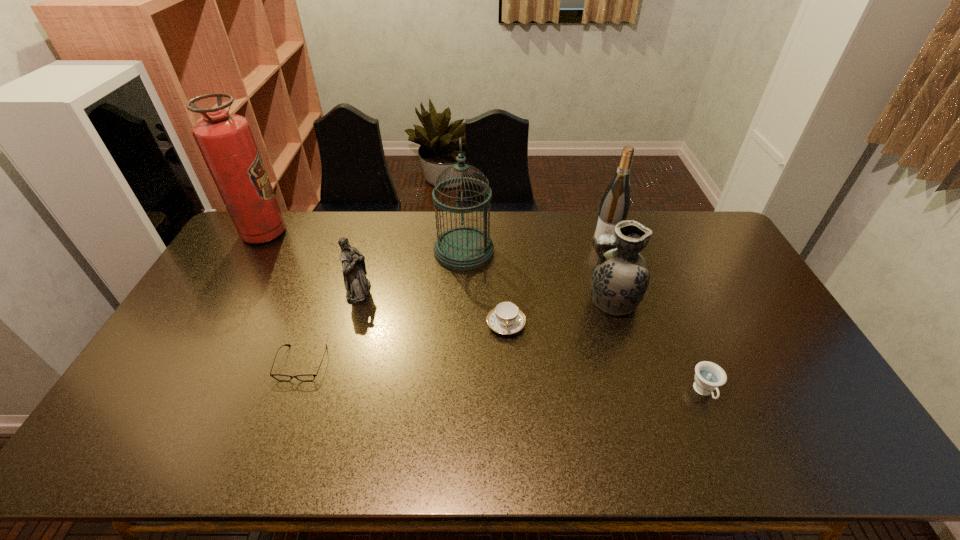
Locate an element on the screen. This screenshot has width=960, height=540. free spot located 0.350m on the front-facing side of the birdcage is located at coordinates (591, 251).

Locate an element on the screen. The height and width of the screenshot is (540, 960). free space located on the right of the wine bottle is located at coordinates (720, 241).

You are a GUI agent. You are given a task and a screenshot of the screen. Output one action in this format:
    pyautogui.click(x=<x>, y=<y>)
    Task: Click on the vacant area situated with the handle on the side of the vase
    The height and width of the screenshot is (540, 960).
    Given the screenshot: What is the action you would take?
    coord(557,301)

Locate an element on the screen. free space located with the handle on the side of the vase is located at coordinates (475, 301).

Where is `free space located 0.320m with the handle on the side of the vase`? Image resolution: width=960 pixels, height=540 pixels. free space located 0.320m with the handle on the side of the vase is located at coordinates (482, 301).

Locate an element on the screen. free space located 0.370m on the front-facing side of the fourth shortest object is located at coordinates (485, 292).

Find the location of a particular element. vacant space located 0.230m on the side with the handle of the left teacup is located at coordinates (511, 410).

At what (x,y) coordinates should I click in order to perform the action: click on free location located on the front-facing side of the spectacles. Please return your answer as a coordinate pair (x, y). This screenshot has height=540, width=960. Looking at the image, I should click on (288, 403).

The height and width of the screenshot is (540, 960). I want to click on fire extinguisher present at the far edge, so click(x=226, y=142).

You are a GUI agent. You are given a task and a screenshot of the screen. Output one action in this format:
    pyautogui.click(x=<x>, y=<y>)
    Task: Click on the birdcage situated at the far edge
    The height and width of the screenshot is (540, 960).
    Given the screenshot: What is the action you would take?
    pyautogui.click(x=464, y=248)